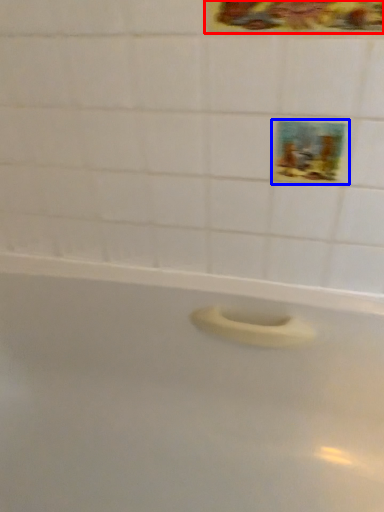
Question: Which point is further to the camera, decorative picture (highlighted by a red box) or decorative picture (highlighted by a blue box)?

Choices:
 (A) decorative picture
 (B) decorative picture

Answer: (B)